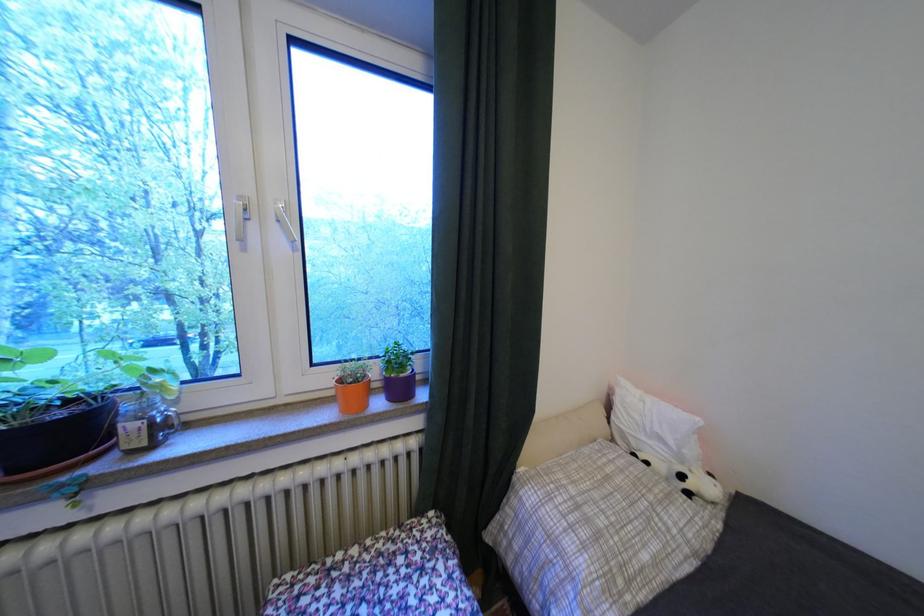
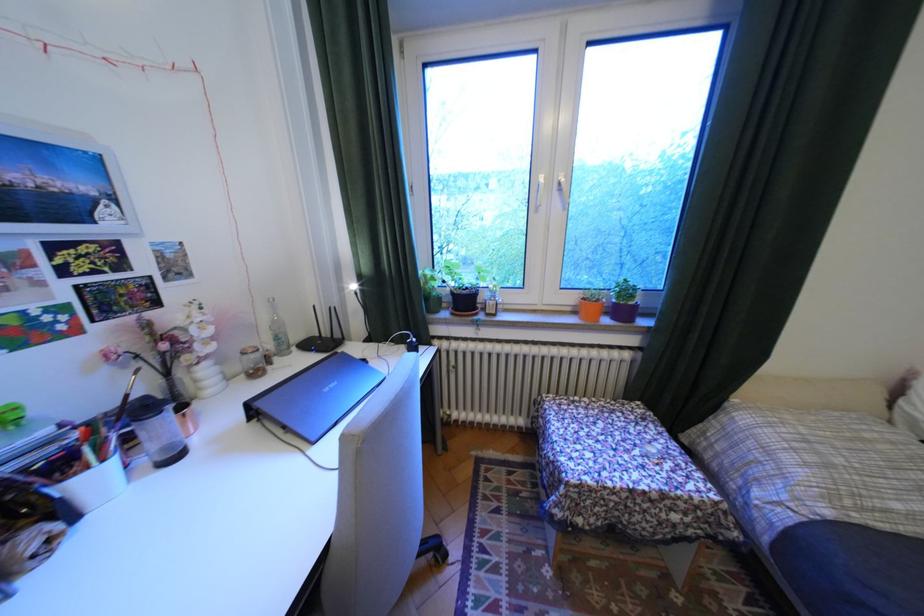
Find the pixel in the second image that matches (x=343, y=392) in the first image.

(580, 309)